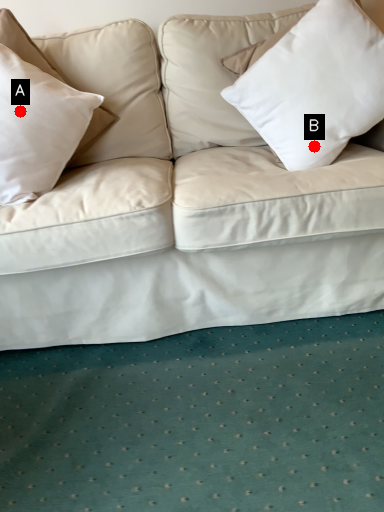
Question: Two points are circled on the image, labeled by A and B beside each circle. Which point is closer to the camera?

Choices:
 (A) A is closer
 (B) B is closer

Answer: (A)